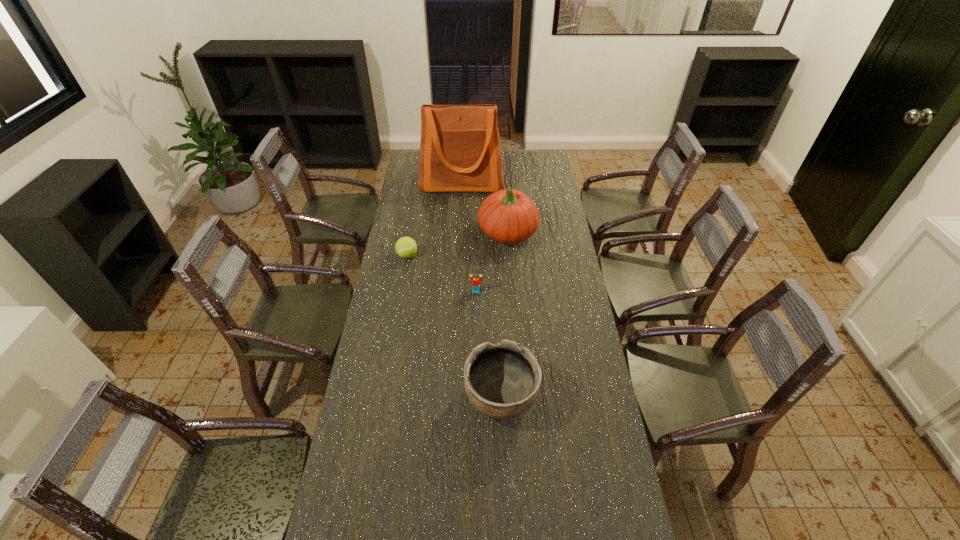
Where is `vacant region located 0.080m on the front of the tennis ball`? This screenshot has width=960, height=540. vacant region located 0.080m on the front of the tennis ball is located at coordinates (404, 275).

Locate an element on the screen. The height and width of the screenshot is (540, 960). vacant space located 0.270m on the face of the Lego is located at coordinates (475, 347).

At what (x,y) coordinates should I click in order to perform the action: click on object that is at the far edge. Please return your answer as a coordinate pair (x, y). Looking at the image, I should click on (460, 151).

This screenshot has width=960, height=540. I want to click on shopping bag that is positioned at the left edge, so click(460, 151).

This screenshot has width=960, height=540. What are the coordinates of `tennis ball present at the left edge` in the screenshot? It's located at (406, 247).

I want to click on object situated at the right edge, so click(x=509, y=216).

Where is `object that is at the far left corner`? object that is at the far left corner is located at coordinates (460, 151).

You are a GUI agent. You are given a task and a screenshot of the screen. Output one action in this format:
    pyautogui.click(x=<x>, y=<y>)
    Task: Click on the vacant area at the far edge
    
    Given the screenshot: What is the action you would take?
    pyautogui.click(x=522, y=165)

Where is `free spot at the left edge of the desktop`? Image resolution: width=960 pixels, height=540 pixels. free spot at the left edge of the desktop is located at coordinates (416, 207).

In the image, there is a desktop. Identify the location of blank space at the right edge. (555, 220).